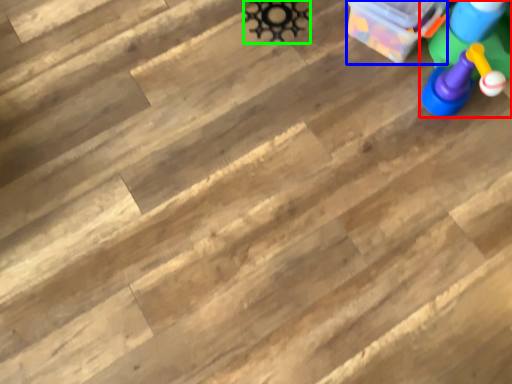
Question: Which is farther away from toy (highlighted by a red box)? cardboard box (highlighted by a blue box) or toy (highlighted by a green box)?

Choices:
 (A) cardboard box
 (B) toy

Answer: (B)